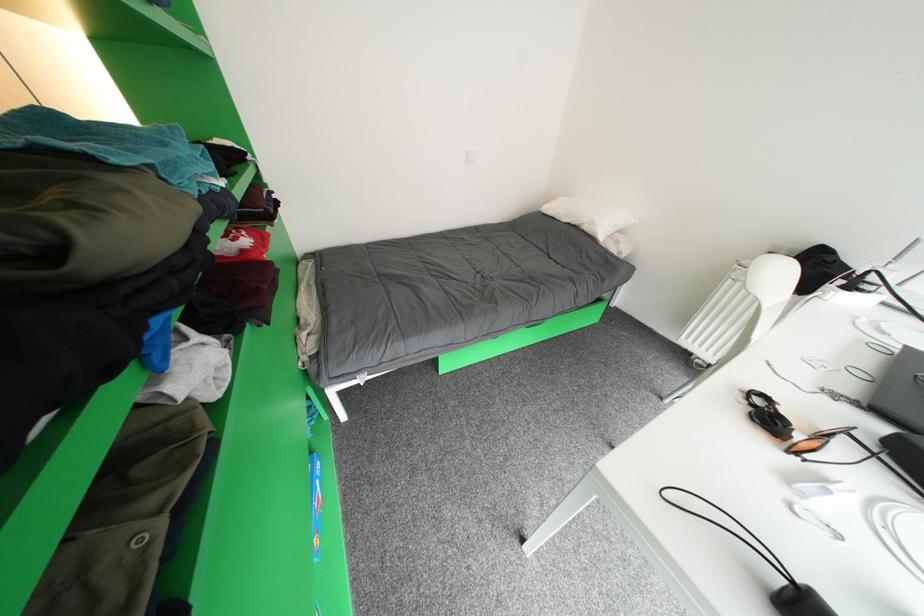
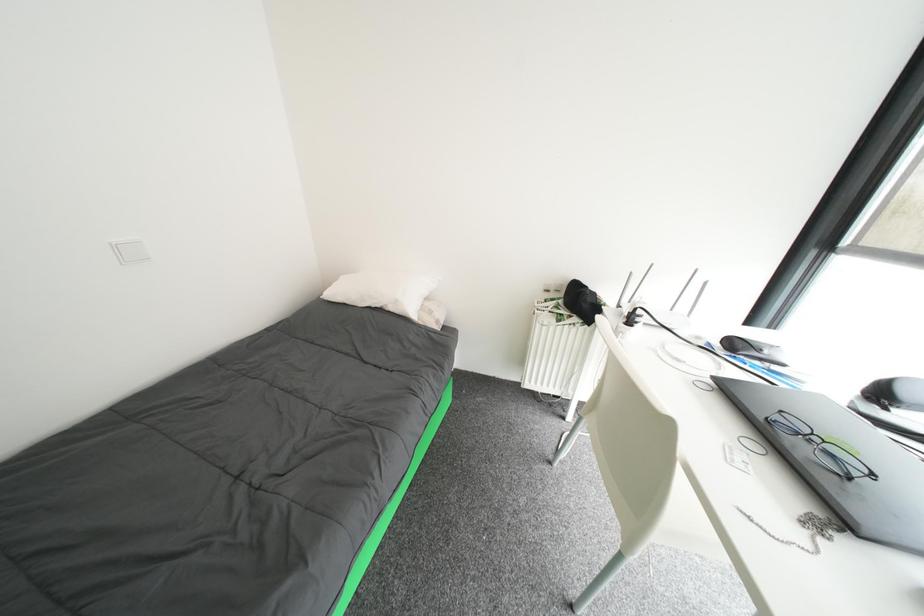
Question: The first image is from the beginning of the video and the second image is from the end. How did the camera likely rotate when shooting the video?

Choices:
 (A) Left
 (B) Right
 (C) Up
 (D) Down

Answer: (B)